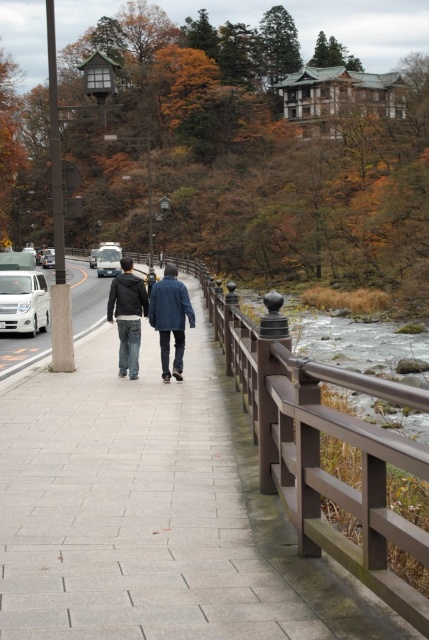
Question: Among these points, which one is farthest from the camera?

Choices:
 (A) (148, 308)
 (B) (108, 310)
 (C) (117, 397)

Answer: (A)

Question: Where is brown wooden railing at center-right located in relation to silver metallic van at center in the image?

Choices:
 (A) below
 (B) above

Answer: (A)

Question: Can you confirm if brown wooden railing at lower right is positioned above blue fabric coat at center?

Choices:
 (A) yes
 (B) no

Answer: (A)

Question: Which point is closer to the camera?

Choices:
 (A) (114, 276)
 (B) (157, 310)
 (C) (117, 282)
 (D) (93, 259)

Answer: (B)

Question: Does blue fabric coat at center have a lesser width compared to silver metallic van at center?

Choices:
 (A) no
 (B) yes

Answer: (B)

Question: Which point is farther to the camera?

Choices:
 (A) (96, 252)
 (B) (27, 300)
 (C) (144, 284)
 (D) (195, 356)

Answer: (A)